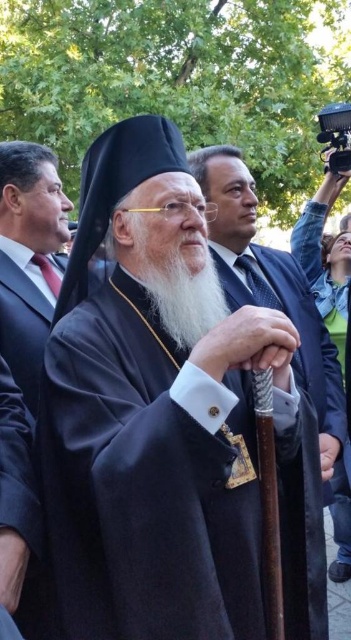
Find the location of a particular element. The height and width of the screenshot is (640, 351). matte black robe at center is located at coordinates (281, 310).

Which is more to the right, black velvet robe at center or matte black robe at center?

matte black robe at center is more to the right.

Does point (148, 300) come behind point (242, 188)?

No, it is not.

Between point (159, 554) and point (328, 353), which one is positioned behind?

The point (328, 353) is behind.

Identify the location of black velvet robe at center. (146, 483).

Does blue denim jacket at upper right have a greater height compared to white matte beard at center?

Yes, blue denim jacket at upper right is taller than white matte beard at center.

Which is below, blue denim jacket at upper right or white matte beard at center?

Positioned lower is blue denim jacket at upper right.

Does point (316, 268) lie behind point (174, 278)?

Yes, it is.

The height and width of the screenshot is (640, 351). In order to click on blue denim jacket at upper right in this screenshot , I will do `click(327, 264)`.